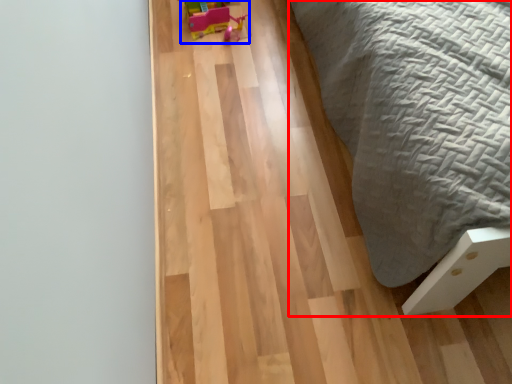
Question: Which object appears closest to the camera in this image, furniture (highlighted by a red box) or toy (highlighted by a blue box)?

Choices:
 (A) furniture
 (B) toy

Answer: (A)